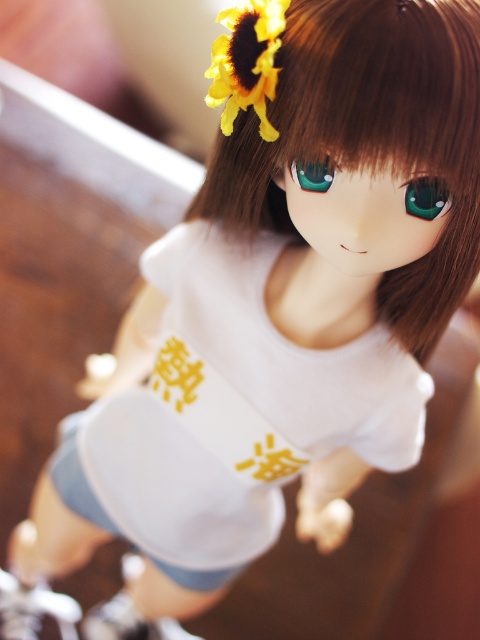
You are a photographer taking a picture of the doll. You notice two points on the doll, one at point coordinates point (141, 481) and another at point coordinates point (304, 76). If you want to focus on the point that is closer to the camera, which coordinate should you choose?

Point (304, 76) is closer to the camera than point (141, 481), so you should focus on point coordinates point (304, 76).